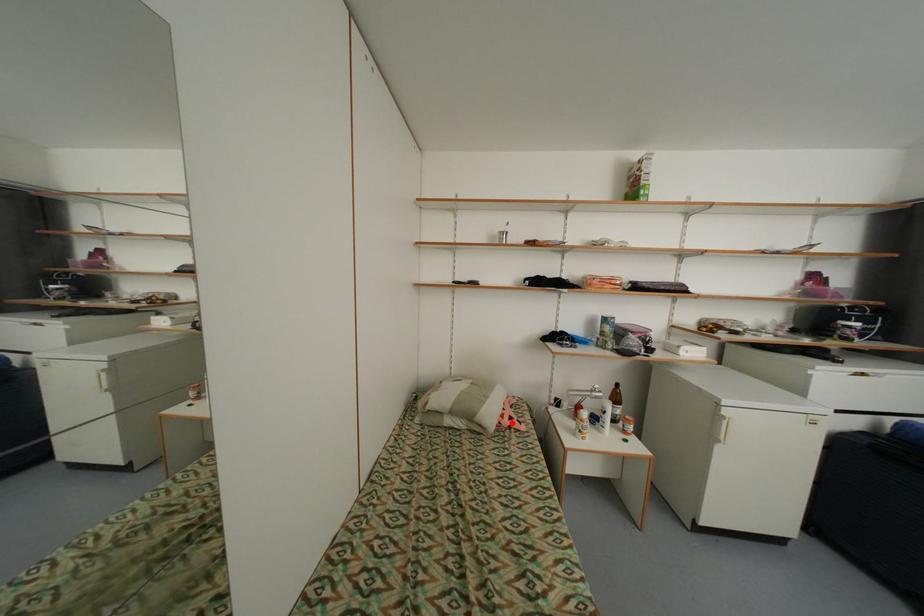
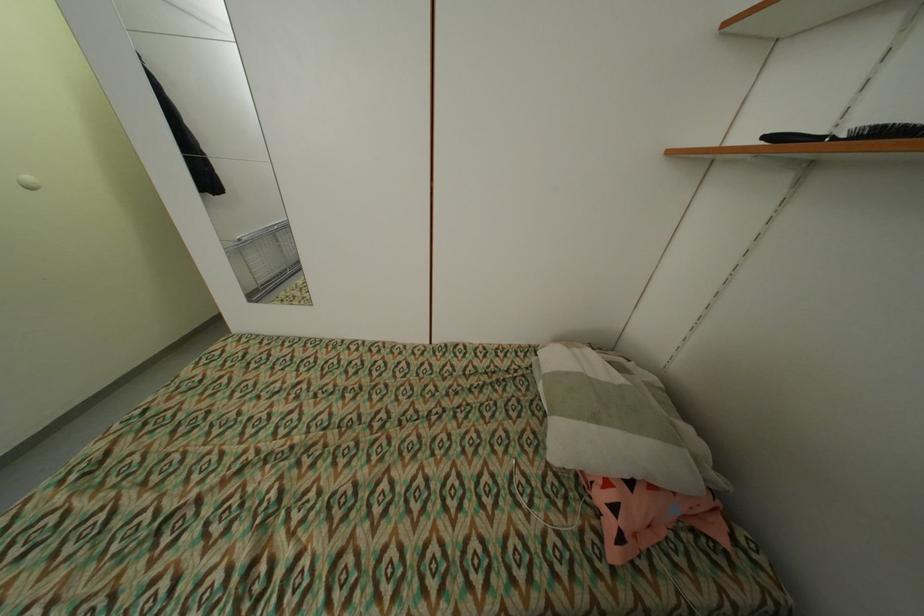
Where in the second image is the point corresponding to the highlighted location from the first image?

(606, 498)